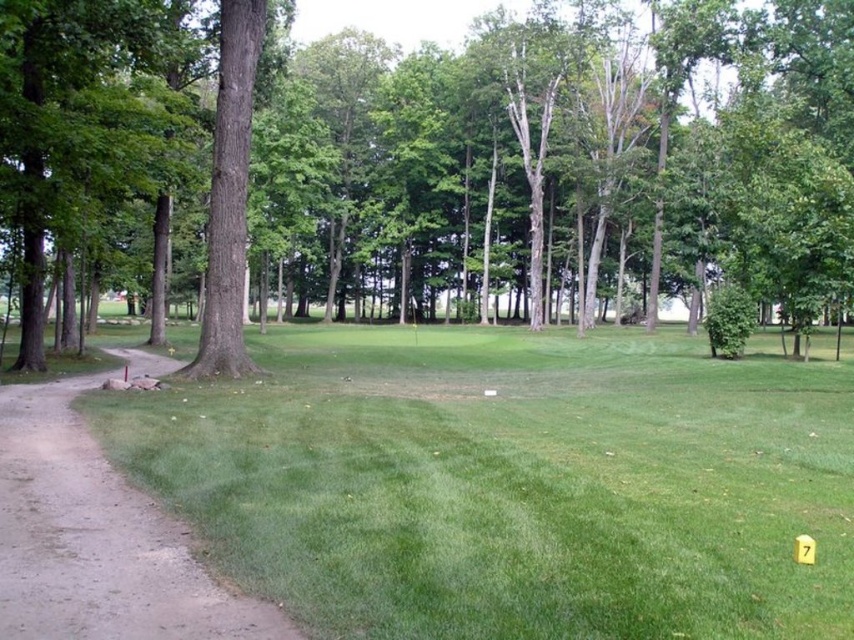
Is green leafy tree at center smaller than green grassy area at lower left?

Incorrect, green leafy tree at center is not smaller in size than green grassy area at lower left.

Between green leafy tree at center and green grassy area at lower left, which one has more height?

Standing taller between the two is green leafy tree at center.

Does point (811, 253) lie in front of point (578, 596)?

No, (811, 253) is further to viewer.

Find the location of a particular element. The image size is (854, 640). green leafy tree at center is located at coordinates (430, 156).

Between green grassy area at lower left and dirt/gravel path at left, which one has more height?

Standing taller between the two is green grassy area at lower left.

Between point (633, 348) and point (197, 621), which one is positioned behind?

Point (633, 348)

Find the location of `green grassy area at lower left`. green grassy area at lower left is located at coordinates (512, 483).

Is green leafy tree at center below dirt/gravel path at left?

No, green leafy tree at center is not below dirt/gravel path at left.

Does green leafy tree at center lie behind dirt/gravel path at left?

Yes, green leafy tree at center is further from the viewer.

Is point (73, 38) behind point (1, 410)?

That is True.

Where is `green leafy tree at center`? The image size is (854, 640). green leafy tree at center is located at coordinates (430, 156).